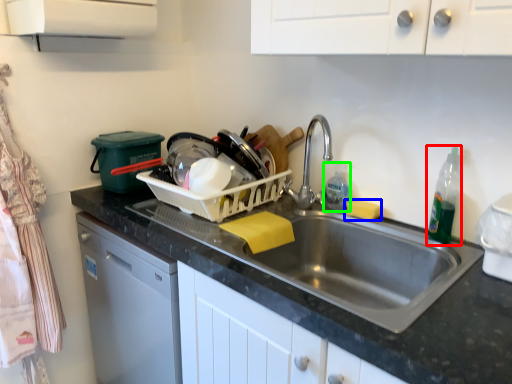
Question: Which object is the closest to the bottle (highlighted by a red box)? Choose among these: food (highlighted by a blue box) or cleaning product (highlighted by a green box).

Choices:
 (A) food
 (B) cleaning product

Answer: (A)